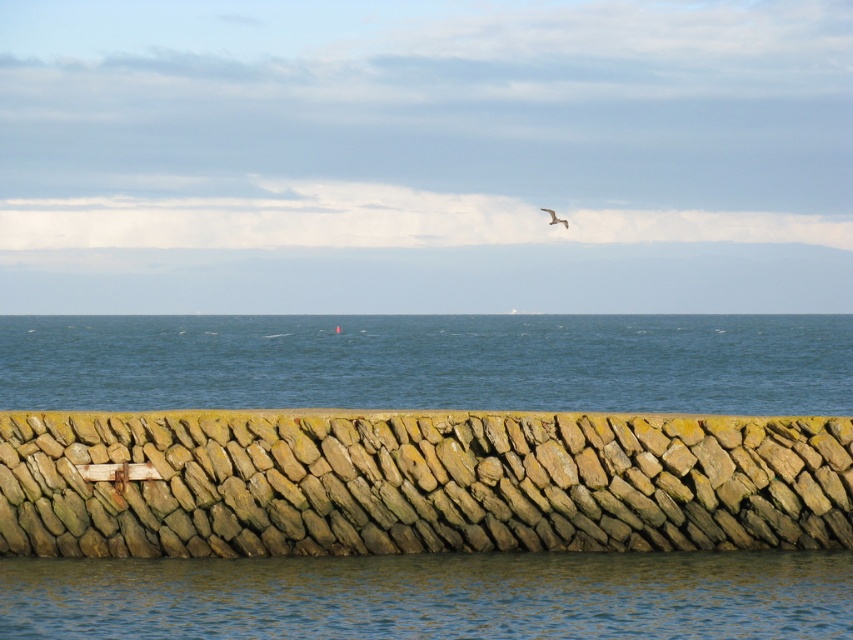
Question: Among these points, which one is farthest from the camera?

Choices:
 (A) (772, 317)
 (B) (91, 572)
 (C) (543, 209)
 (D) (331, 499)

Answer: (C)

Question: Can you confirm if blue water at center is thinner than white feathered bird at upper center?

Choices:
 (A) no
 (B) yes

Answer: (A)

Question: Among these objects, which one is farthest from the camera?

Choices:
 (A) blue water at lower center
 (B) blue water at center
 (C) yellowish stone wall at lower center

Answer: (B)

Question: Can you confirm if yellowish stone wall at lower center is positioned above blue water at lower center?

Choices:
 (A) no
 (B) yes

Answer: (B)

Question: Does yellowish stone wall at lower center appear over blue water at center?

Choices:
 (A) no
 (B) yes

Answer: (A)

Question: Which point is closer to the camera taking this photo?

Choices:
 (A) (595, 486)
 (B) (550, 212)

Answer: (A)